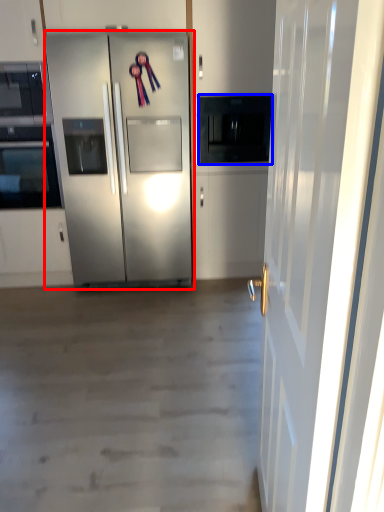
Question: Which object appears farthest to the camera in this image, refrigerator (highlighted by a red box) or appliance (highlighted by a blue box)?

Choices:
 (A) refrigerator
 (B) appliance

Answer: (B)